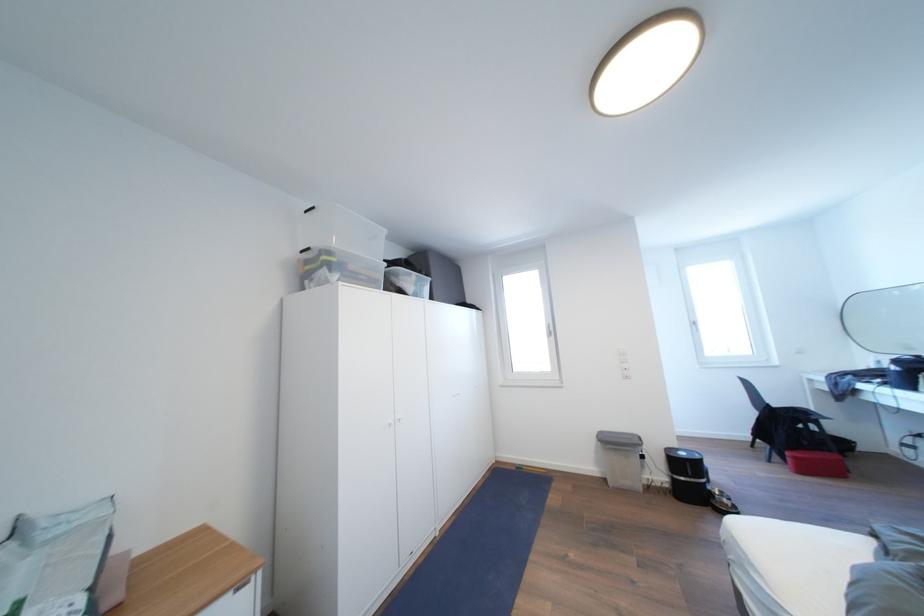
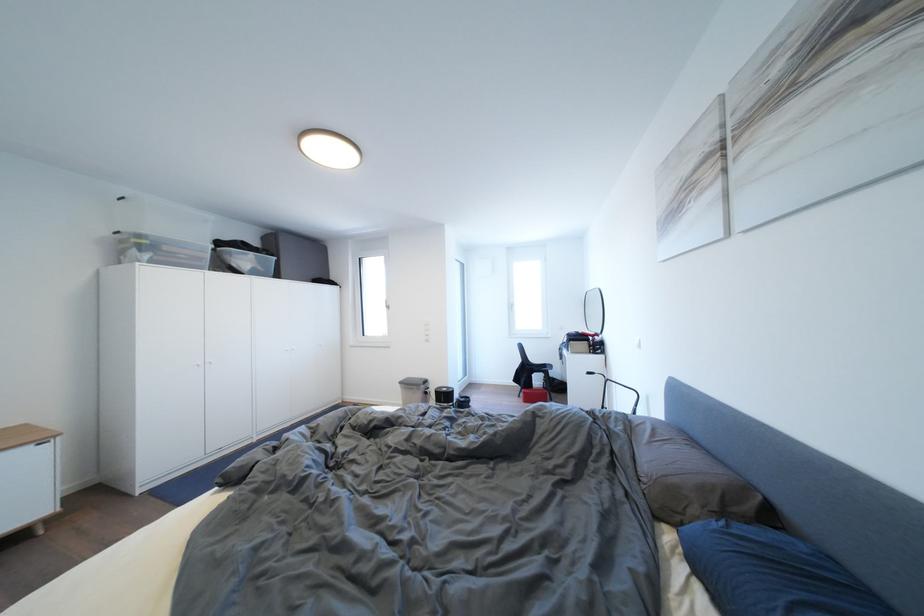
Where in the second image is the point corresponding to (405,280) from the first image?

(237, 259)